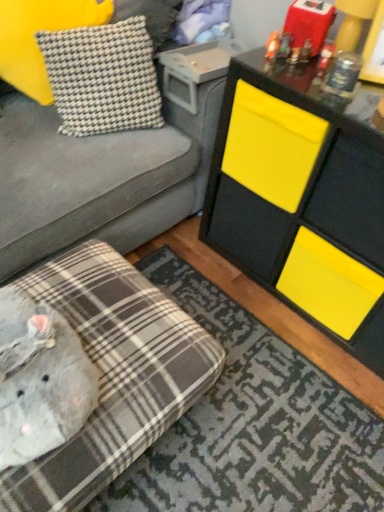
Question: From a real-world perspective, is houndstooth fabric pillow at upper left, marked as the 2th pillow in a right-to-left arrangement, physically located above or below gray corduroy studio couch at upper left, the 1th studio couch viewed from the top?

Choices:
 (A) above
 (B) below

Answer: (A)

Question: Is houndstooth fabric pillow at upper left, marked as the 2th pillow in a right-to-left arrangement, wider or thinner than gray corduroy studio couch at upper left, which is the 2th studio couch from bottom to top?

Choices:
 (A) wide
 (B) thin

Answer: (B)

Question: Which is nearer to the houndstooth fabric pillow at upper left, acting as the second pillow starting from the left?

Choices:
 (A) yellow matte cabinet at upper right
 (B) plaid fabric mat at lower left
 (C) matte plastic toy at upper right, positioned as the 1th toy in right-to-left order
 (D) gray corduroy studio couch at upper left, the 1th studio couch viewed from the top
 (E) matte orange figurine at upper right, which is counted as the first toy, starting from the left

Answer: (D)

Question: Estimate the real-world distances between objects in this image. Which object is closer to the houndstooth fabric pillow at upper left, placed as the 1th pillow when sorted from right to left?

Choices:
 (A) gray corduroy studio couch at upper left, which is the 2th studio couch from bottom to top
 (B) houndstooth fabric pillow at upper left, marked as the 2th pillow in a right-to-left arrangement
 (C) matte orange figurine at upper right, which appears as the 2th toy when viewed from the right
 (D) plaid fabric mat at lower left
 (E) plaid fabric ottoman at lower left, the 1th studio couch positioned from the bottom

Answer: (B)